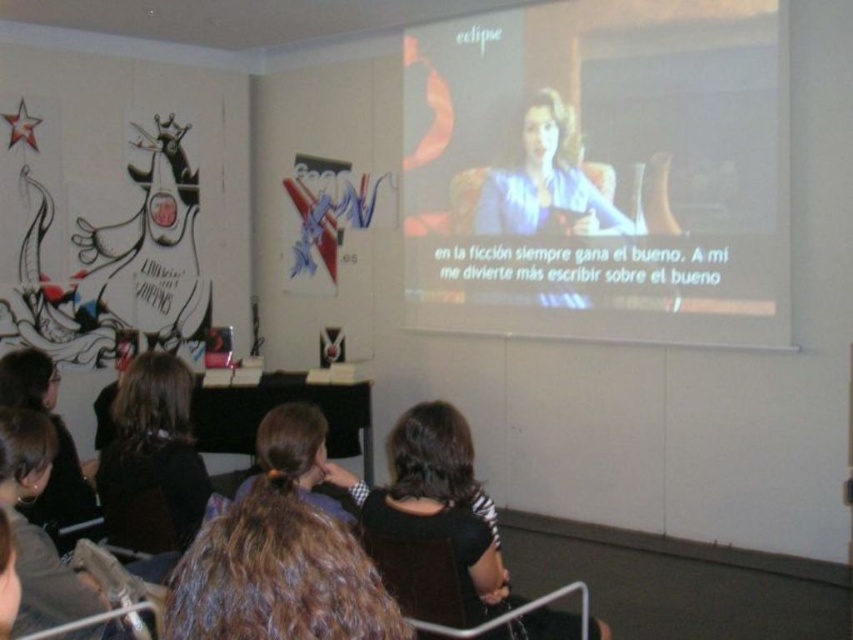
Which of these two, brown hair at center or black and white striped shirt at center, stands taller?

black and white striped shirt at center is taller.

How far apart are brown hair at center and black and white striped shirt at center?

brown hair at center is 1.33 meters away from black and white striped shirt at center.

Which is behind, point (305, 515) or point (426, 452)?

Point (426, 452)

Find the location of a particular element. The height and width of the screenshot is (640, 853). brown hair at center is located at coordinates (277, 576).

Is white matte projection screen at upper center to the left of black and white striped shirt at center from the viewer's perspective?

In fact, white matte projection screen at upper center is to the right of black and white striped shirt at center.

Is white matte projection screen at upper center shorter than black and white striped shirt at center?

Incorrect, white matte projection screen at upper center's height does not fall short of black and white striped shirt at center's.

Is point (689, 253) behind point (466, 490)?

Yes, point (689, 253) is farther from viewer.

Locate an element on the screen. This screenshot has height=640, width=853. white matte projection screen at upper center is located at coordinates (599, 172).

Does point (430, 518) come in front of point (184, 513)?

Yes.

What do you see at coordinates (437, 500) in the screenshot? Image resolution: width=853 pixels, height=640 pixels. I see `black and white striped shirt at center` at bounding box center [437, 500].

Between point (537, 609) and point (114, 536), which one is positioned behind?

Positioned behind is point (114, 536).

Identify the location of black and white striped shirt at center. The image size is (853, 640). (437, 500).